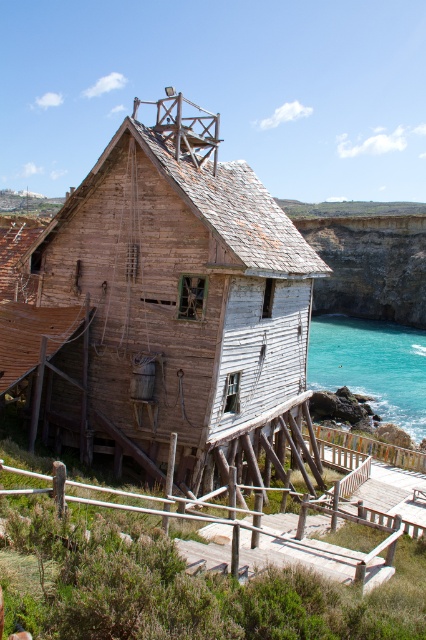
Does weathered wood hut at center appear over rugged stone cliff at right?

No, weathered wood hut at center is not above rugged stone cliff at right.

Image resolution: width=426 pixels, height=640 pixels. I want to click on weathered wood hut at center, so click(161, 305).

Between weathered wood hut at center and turquoise water at lower right, which one is positioned higher?

weathered wood hut at center is higher up.

Does weathered wood hut at center have a lesser height compared to turquoise water at lower right?

In fact, weathered wood hut at center may be taller than turquoise water at lower right.

Does point (241, 429) come in front of point (354, 321)?

Yes, it is in front of point (354, 321).

At what (x,y) coordinates should I click in order to perform the action: click on weathered wood hut at center. Please return your answer as a coordinate pair (x, y). The image size is (426, 640). Looking at the image, I should click on (161, 305).

Which is behind, point (363, 298) or point (393, 324)?

The point (363, 298) is behind.

Is rugged stone cliff at right above turquoise water at lower right?

Yes, rugged stone cliff at right is above turquoise water at lower right.

Locate an element on the screen. The image size is (426, 640). rugged stone cliff at right is located at coordinates (370, 266).